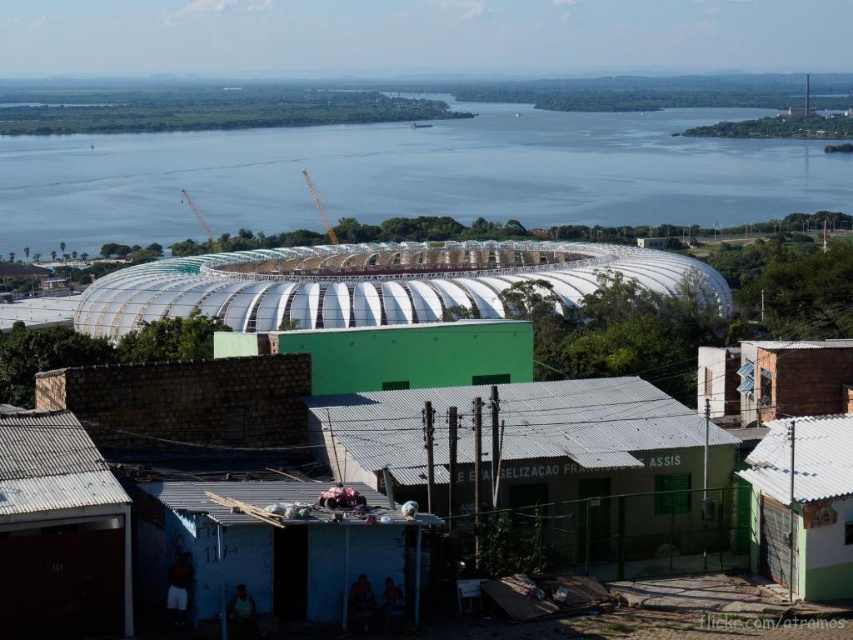
You are a construction worker assessing the site. You need to determine if the white translucent dome at center can be installed without obstructing the blue water at center. Based on their heights, can the dome be installed without affecting the water level?

The white translucent dome at center has a lesser height compared to blue water at center. Since the dome is shorter than the water level, installing it would not obstruct or affect the blue water at center.

You are a construction worker standing at the edge of the blue water at center. You need to move towards the white translucent dome at center. Which direction should you walk to reach it?

The white translucent dome at center is to the right of blue water at center, so you should walk to the right to reach it.

You are standing at the point marked by the coordinates (511, 378) in the image. What structure are you directly facing? Please provide the exact label from the objects list.

The point marked by the coordinates (511, 378) corresponds to the white translucent dome at center, so you are directly facing the white translucent dome at center.